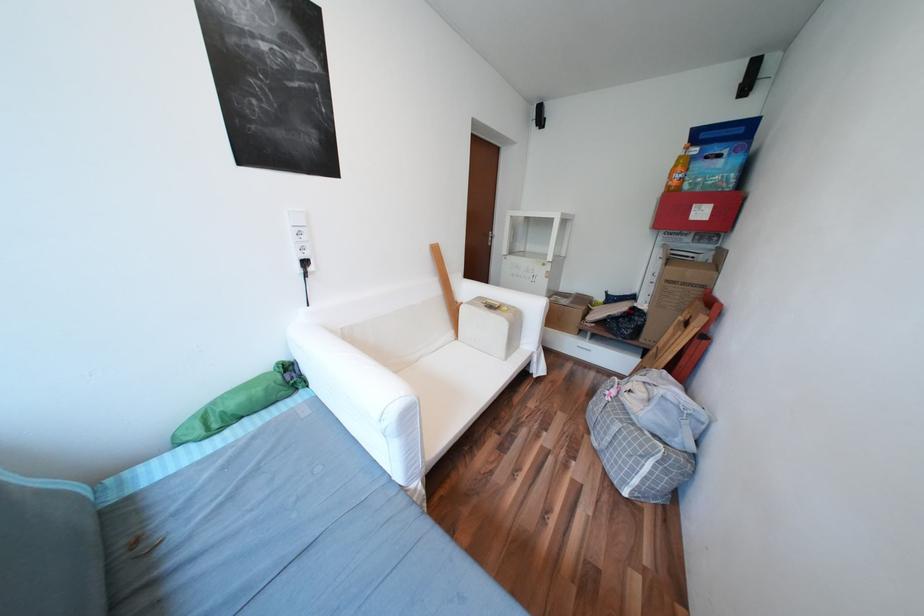
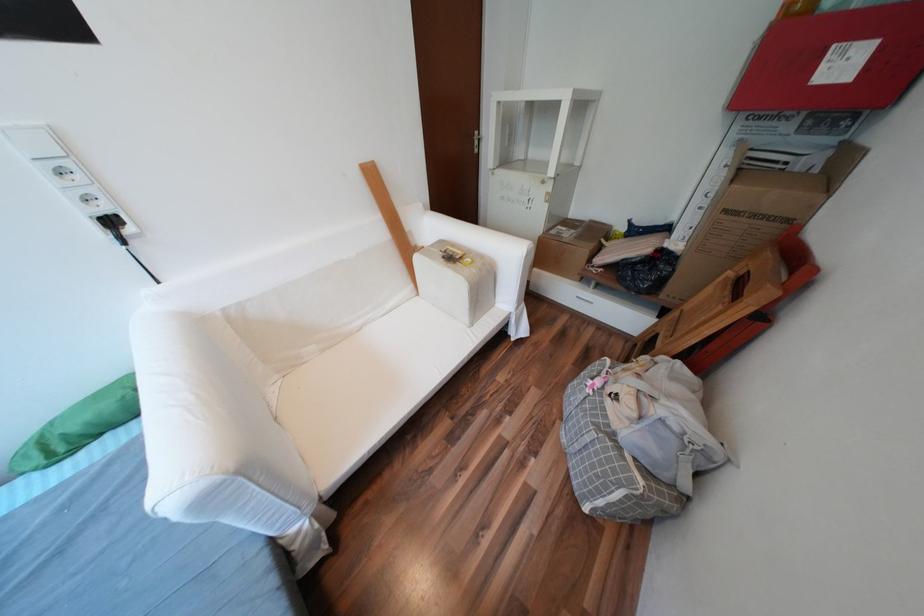
Locate, in the second image, the point that corresponds to (542,352) in the first image.

(519, 313)